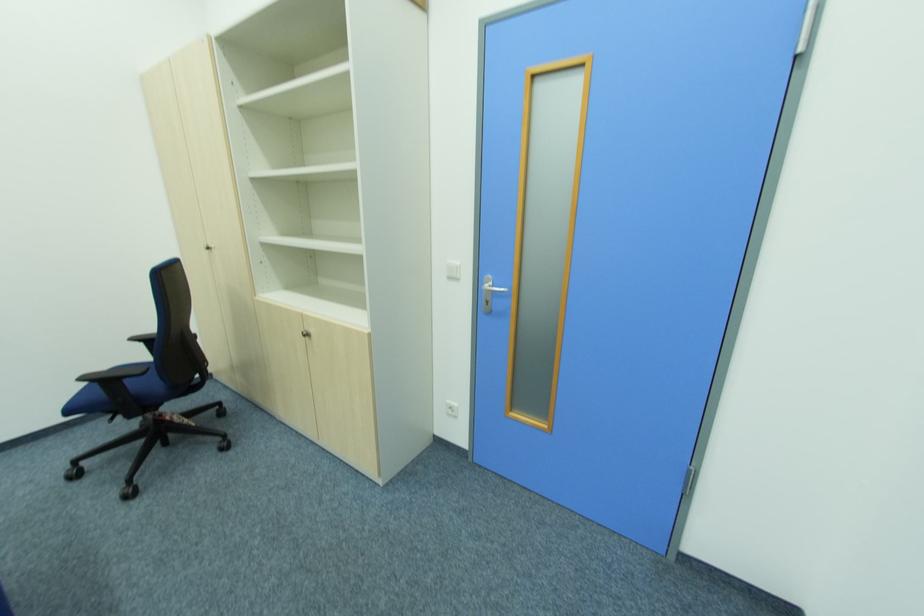
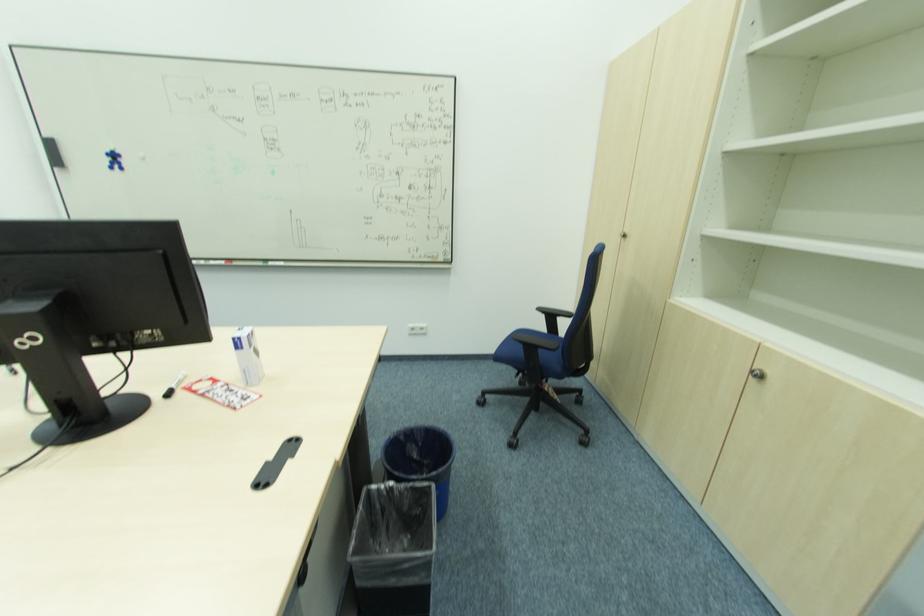
Where in the second image is the point corresponding to the point at 100,387 from the first image?

(524, 347)